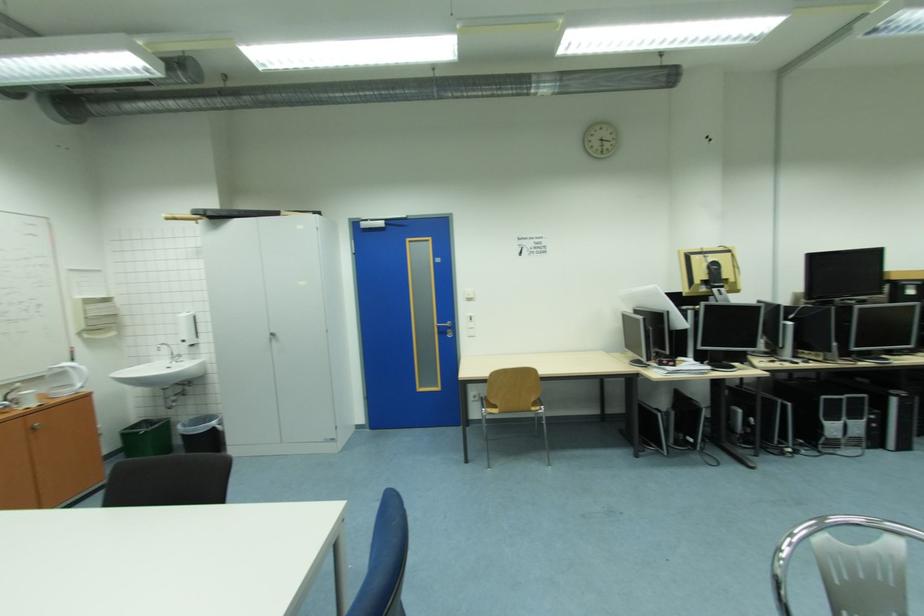
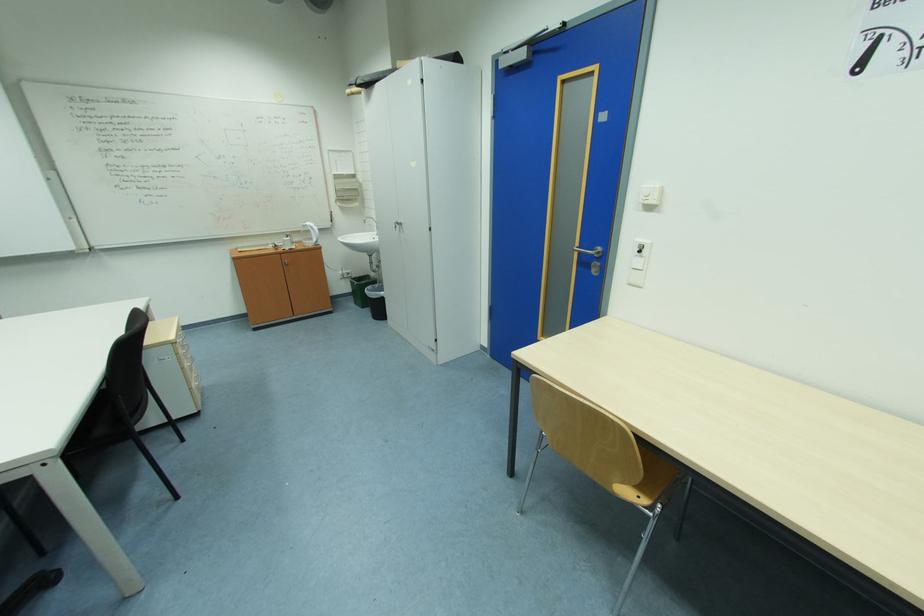
The point at (445, 328) is marked in the first image. Where is the corresponding point in the second image?

(587, 253)